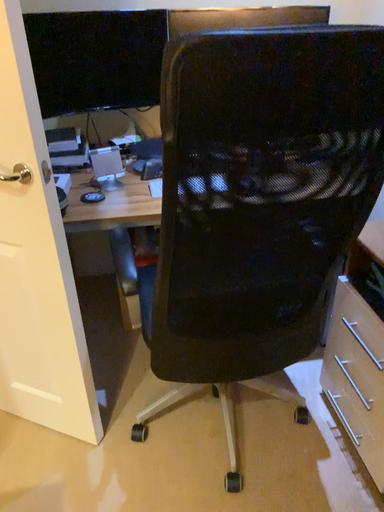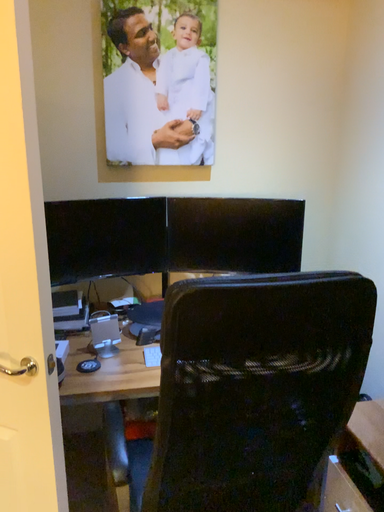
Question: How did the camera likely rotate when shooting the video?

Choices:
 (A) rotated downward
 (B) rotated upward

Answer: (B)